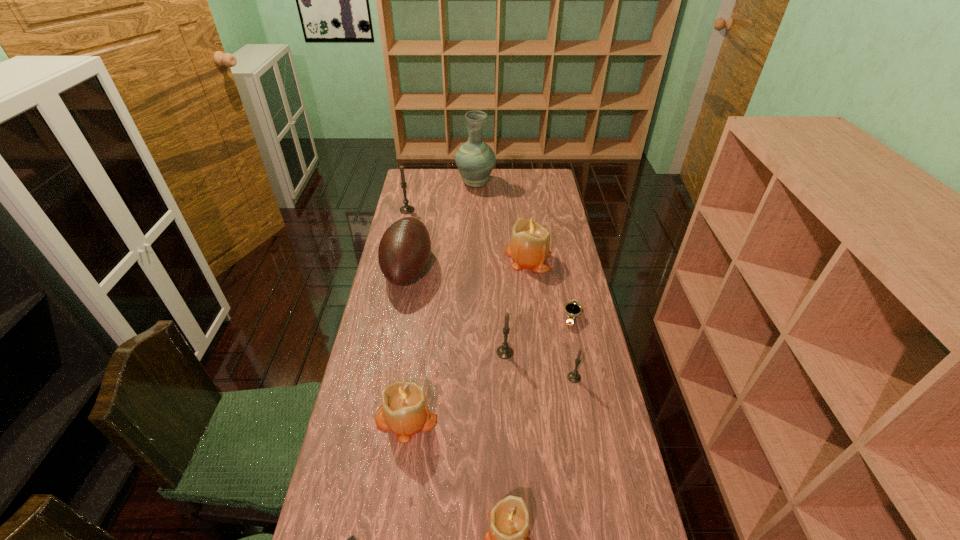
Identify the location of the farthest object. This screenshot has width=960, height=540. (475, 160).

The height and width of the screenshot is (540, 960). I want to click on pitcher, so click(475, 160).

This screenshot has width=960, height=540. Find the location of `the farthest gray candle`. the farthest gray candle is located at coordinates (406, 209).

Find the location of `the leftmost gray candle`. the leftmost gray candle is located at coordinates [x=406, y=209].

You are a GUI agent. You are given a task and a screenshot of the screen. Output one action in this format:
    pyautogui.click(x=<x>, y=<y>)
    Task: Click on the farthest beige candle
    The width and height of the screenshot is (960, 540).
    Given the screenshot: What is the action you would take?
    pyautogui.click(x=529, y=248)

In order to click on the biggest beige candle in this screenshot , I will do `click(529, 248)`.

The height and width of the screenshot is (540, 960). Identify the location of football (American). (404, 250).

Locate an element on the screen. The width and height of the screenshot is (960, 540). the second biggest gray candle is located at coordinates (505, 351).

Where is `the sixth farthest object`? This screenshot has height=540, width=960. the sixth farthest object is located at coordinates (505, 351).

The width and height of the screenshot is (960, 540). What are the coordinates of `the second farthest beige candle` in the screenshot? It's located at (x=404, y=410).